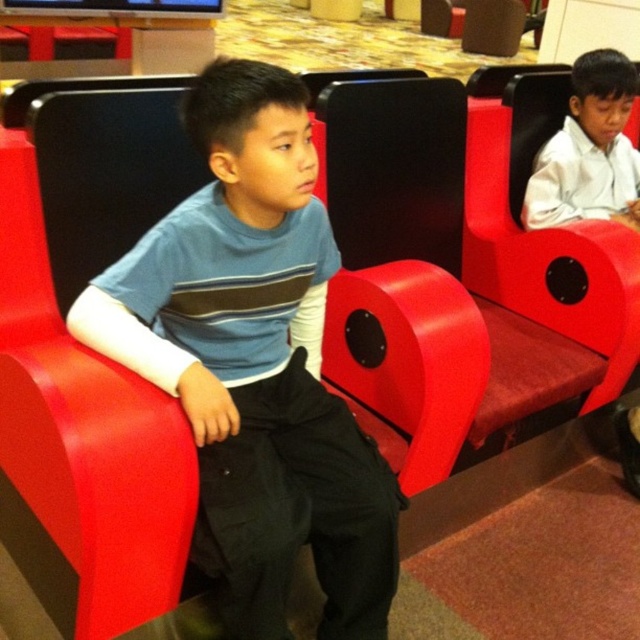
Between matte blue shirt at center and white glossy shirt at upper right, which one appears on the left side from the viewer's perspective?

matte blue shirt at center

Can you confirm if matte blue shirt at center is smaller than white glossy shirt at upper right?

Actually, matte blue shirt at center might be larger than white glossy shirt at upper right.

Does point (211, 570) lie behind point (608, 118)?

That is False.

The width and height of the screenshot is (640, 640). What are the coordinates of `matte blue shirt at center` in the screenshot? It's located at (256, 364).